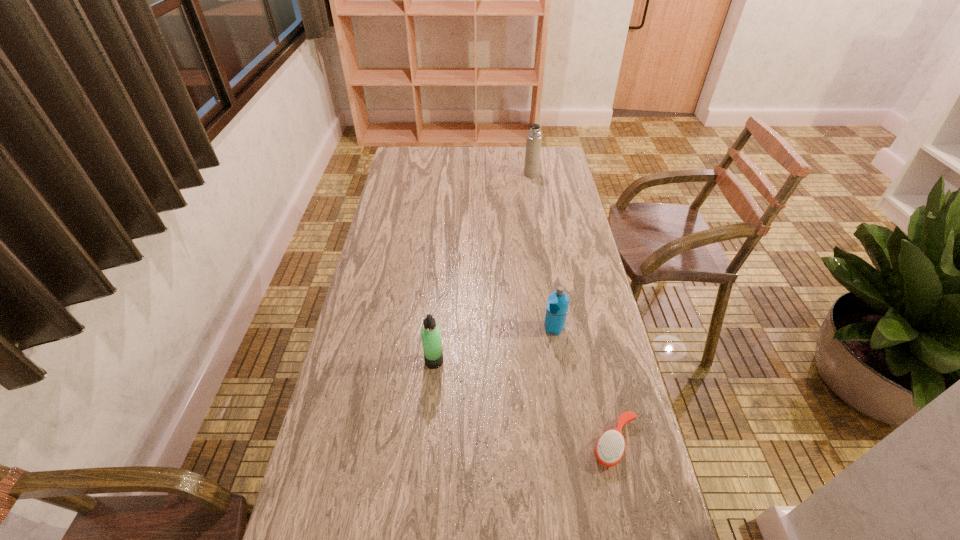
At what (x,y) coordinates should I click in order to perform the action: click on free space that is in between the nearest object and the third nearest object. Please return your answer as a coordinate pair (x, y). This screenshot has height=540, width=960. Looking at the image, I should click on (585, 385).

I want to click on vacant space in between the leftmost object and the tallest thermos bottle, so click(x=483, y=267).

Identify the location of free space between the second nearest object and the farthest thermos bottle. (483, 267).

Identify the location of vacant point located between the third nearest object and the nearest thermos bottle. The width and height of the screenshot is (960, 540). (494, 345).

I want to click on blank region between the second nearest thermos bottle and the farthest thermos bottle, so click(542, 251).

At what (x,y) coordinates should I click in order to perform the action: click on free spot between the third nearest object and the leftmost thermos bottle. Please return your answer as a coordinate pair (x, y). This screenshot has height=540, width=960. Looking at the image, I should click on (494, 345).

Image resolution: width=960 pixels, height=540 pixels. Identify the location of free spot between the nearest object and the nearest thermos bottle. (525, 402).

Find the location of a particular element. The height and width of the screenshot is (540, 960). object that stands as the closest to the nearest thermos bottle is located at coordinates (557, 306).

Locate an element on the screen. object that stands as the closest to the nearest object is located at coordinates (557, 306).

Select which thermos bottle is the second closest to the nearest object. Please provide its 2D coordinates. Your answer should be formatted as a tuple, i.e. [(x, y)], where the tuple contains the x and y coordinates of a point satisfying the conditions above.

[(431, 337)]